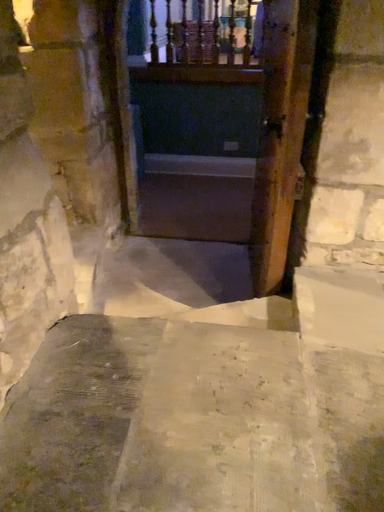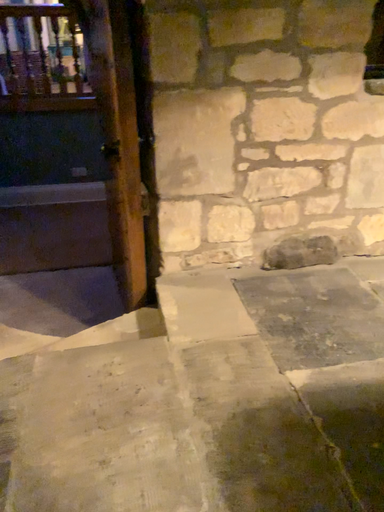
Question: How did the camera likely rotate when shooting the video?

Choices:
 (A) rotated left
 (B) rotated right

Answer: (B)